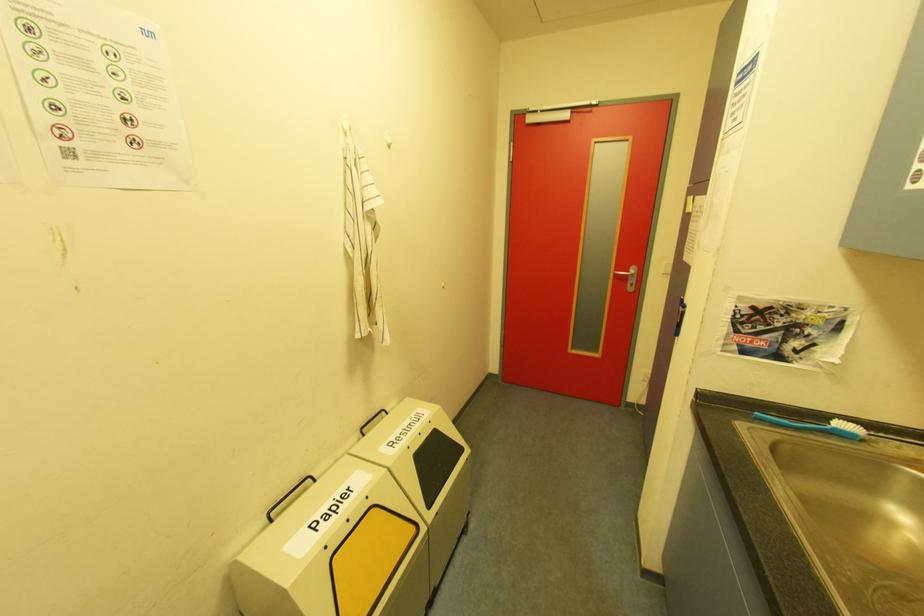
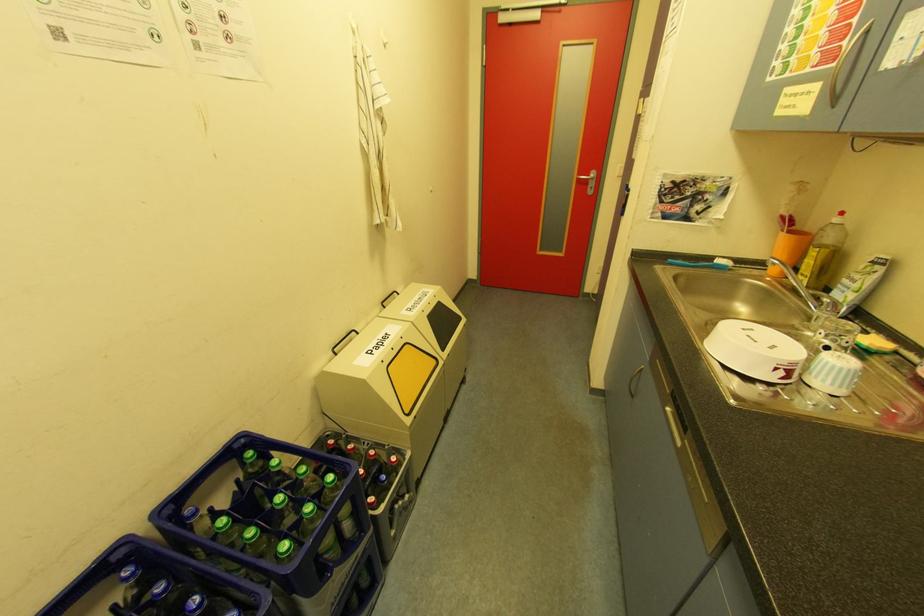
The images are taken continuously from a first-person perspective. In which direction are you moving?

The cameraman walked toward left, backward.